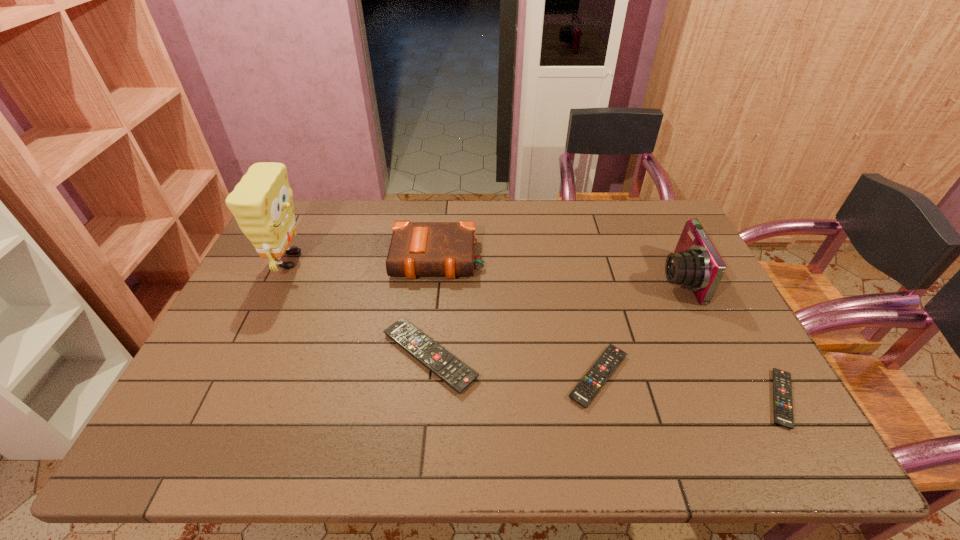
At what (x,y) coordinates should I click in order to perform the action: click on the second object from right to left. Please return your answer as a coordinate pair (x, y). The width and height of the screenshot is (960, 540). Looking at the image, I should click on (695, 264).

Identify the location of vacant position located on the right of the tallest remote control. This screenshot has height=540, width=960. (507, 356).

The height and width of the screenshot is (540, 960). I want to click on vacant region located on the right of the second shortest remote control, so click(759, 376).

Where is `vacant position located 0.350m on the left of the rightmost remote control`? This screenshot has height=540, width=960. vacant position located 0.350m on the left of the rightmost remote control is located at coordinates (610, 399).

Locate an element on the screen. free space located on the spine side of the Bible is located at coordinates (426, 369).

Where is `vacant region located on the face of the leftmost object`? The height and width of the screenshot is (540, 960). vacant region located on the face of the leftmost object is located at coordinates (423, 260).

The width and height of the screenshot is (960, 540). Find the location of `vacant area located on the front-facing side of the fifth object from left to right`. vacant area located on the front-facing side of the fifth object from left to right is located at coordinates (536, 279).

This screenshot has width=960, height=540. I want to click on vacant space located on the front-facing side of the fifth object from left to right, so click(563, 279).

The image size is (960, 540). Find the location of `free point located 0.260m on the front-facing side of the fifth object from left to right`. free point located 0.260m on the front-facing side of the fifth object from left to right is located at coordinates (572, 279).

Where is `Bible that is at the far edge`? Bible that is at the far edge is located at coordinates (416, 249).